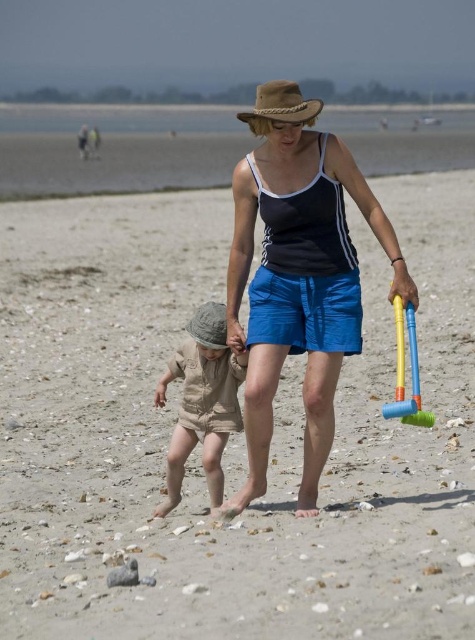
Question: Does fine-grained sand at center appear on the right side of khaki cotton romper at center?

Choices:
 (A) yes
 (B) no

Answer: (B)

Question: Does matte black tank top at center have a lesser width compared to khaki cotton romper at center?

Choices:
 (A) yes
 (B) no

Answer: (B)

Question: Observing the image, what is the correct spatial positioning of matte black tank top at center in reference to blue plastic shovel at right?

Choices:
 (A) right
 (B) left

Answer: (B)

Question: Estimate the real-world distances between objects in this image. Which object is closer to the khaki cotton romper at center?

Choices:
 (A) blue plastic shovel at right
 (B) matte black tank top at center
 (C) fine-grained sand at center
 (D) brown straw cowboy hat at center

Answer: (B)

Question: Which object appears closest to the camera in this image?

Choices:
 (A) brown straw cowboy hat at center
 (B) fine-grained sand at center

Answer: (B)

Question: Considering the real-world distances, which object is farthest from the fine-grained sand at center?

Choices:
 (A) blue plastic shovel at right
 (B) matte black tank top at center

Answer: (A)